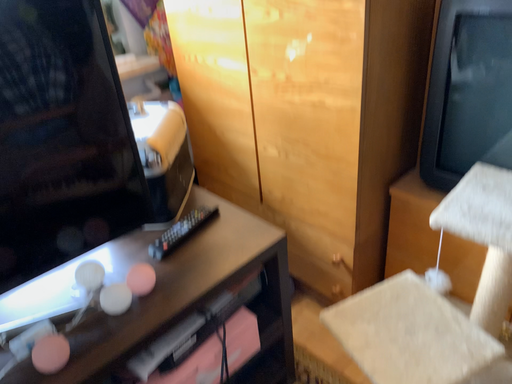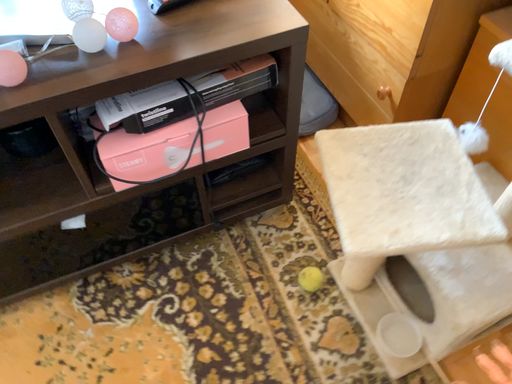
Question: Which way did the camera rotate in the video?

Choices:
 (A) rotated downward
 (B) rotated upward

Answer: (A)